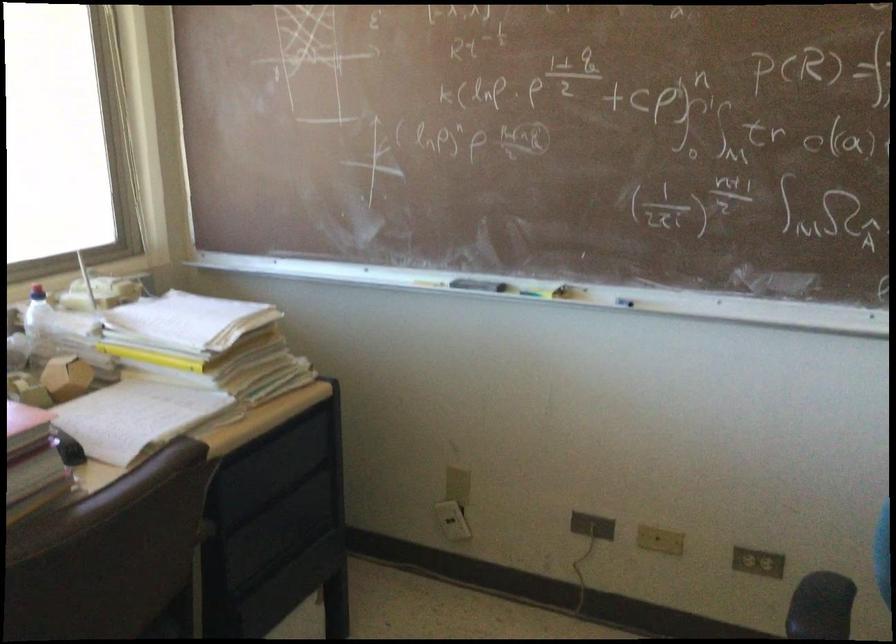
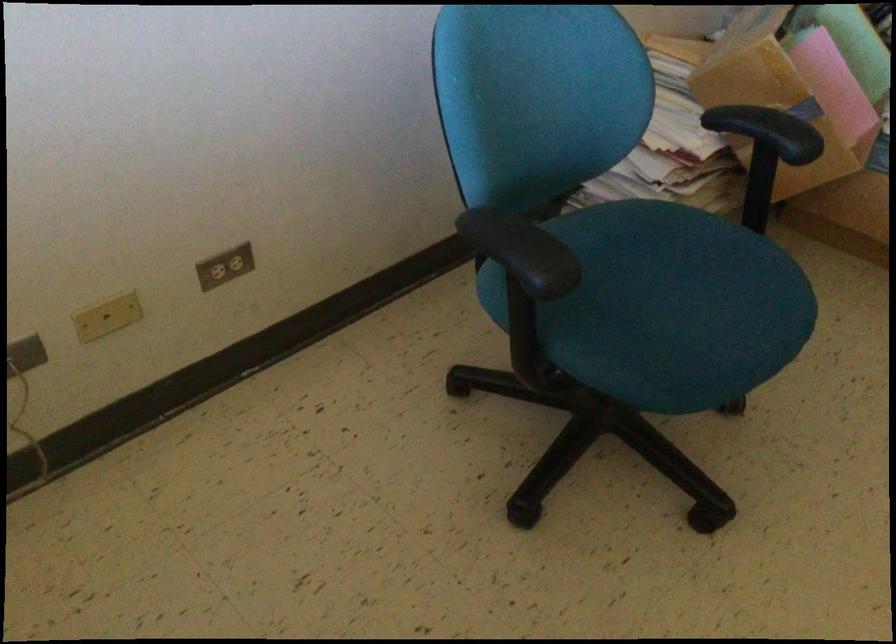
The images are taken continuously from a first-person perspective. In which direction is your viewpoint rotating?

The camera rotated toward right-down.